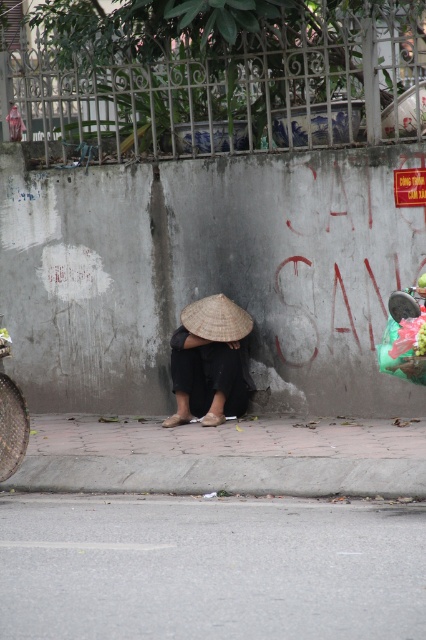
Does gray asphalt pavement at lower center appear over matte straw hat at center?

No, gray asphalt pavement at lower center is not above matte straw hat at center.

Locate an element on the screen. Image resolution: width=426 pixels, height=640 pixels. gray asphalt pavement at lower center is located at coordinates (210, 566).

Is point (351, 548) farther from camera compared to point (178, 364)?

No, (351, 548) is closer to viewer.

I want to click on gray asphalt pavement at lower center, so click(x=210, y=566).

Between point (170, 365) and point (195, 333), which one is positioned in front?

Positioned in front is point (195, 333).

Can you confirm if matte straw hat at center is positioned below brown straw hat at center?

Yes.

Describe the element at coordinates (209, 362) in the screenshot. I see `matte straw hat at center` at that location.

Identify the location of matte straw hat at center. (209, 362).

Which is above, gray asphalt pavement at lower center or gray concrete curb at lower center?

gray concrete curb at lower center is above.

Can you confirm if gray asphalt pavement at lower center is positioned above gray concrete curb at lower center?

No, gray asphalt pavement at lower center is not above gray concrete curb at lower center.

Which is behind, point (279, 570) or point (230, 490)?

The point (230, 490) is behind.

I want to click on gray asphalt pavement at lower center, so click(x=210, y=566).